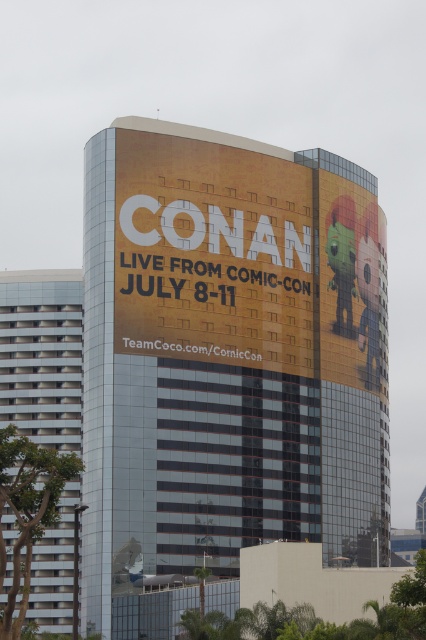
You are an architect analyzing the building facade. Based on the scene, which object has a smaller vertical dimension between the yellow matte sign at center and the white glass windows at left?

The yellow matte sign at center has a lesser height compared to the white glass windows at left, so the yellow matte sign at center has a smaller vertical dimension.

You are standing at the camera position and want to take a photo of the yellow matte sign at center. The camera has a maximum zoom range of 100 feet. Can you capture the sign without moving closer?

The yellow matte sign at center and camera are 313.63 feet apart from each other. Since the camera can only zoom up to 100 feet, you cannot capture the sign without moving closer.